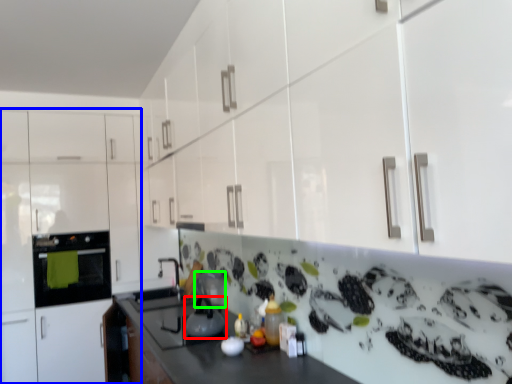
Question: Which object is positioned closest to kitchen appliance (highlighted by a red box)? Select from cabinetry (highlighted by a blue box) and appliance (highlighted by a green box).

Choices:
 (A) cabinetry
 (B) appliance

Answer: (B)